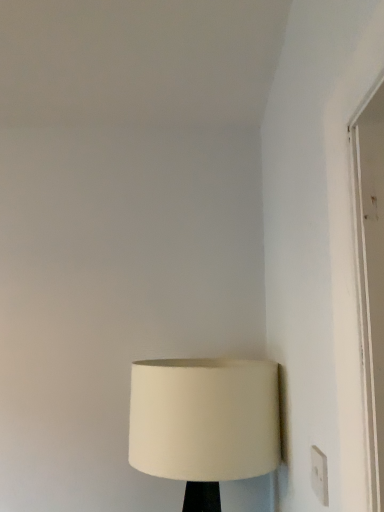
Question: Is point (167, 387) closer or farther from the camera than point (322, 478)?

Choices:
 (A) farther
 (B) closer

Answer: (A)

Question: Is white fabric lampshade at lower center taller or shorter than white plastic electric outlet at lower right?

Choices:
 (A) tall
 (B) short

Answer: (A)

Question: In terms of width, does white fabric lampshade at lower center look wider or thinner when compared to white plastic electric outlet at lower right?

Choices:
 (A) thin
 (B) wide

Answer: (B)

Question: In terms of height, does white plastic electric outlet at lower right look taller or shorter compared to white fabric lampshade at lower center?

Choices:
 (A) short
 (B) tall

Answer: (A)

Question: Does point (324, 460) appear closer or farther from the camera than point (137, 386)?

Choices:
 (A) closer
 (B) farther

Answer: (A)

Question: Do you think white plastic electric outlet at lower right is within white fabric lampshade at lower center, or outside of it?

Choices:
 (A) inside
 (B) outside

Answer: (B)

Question: From the image's perspective, is white plastic electric outlet at lower right located above or below white fabric lampshade at lower center?

Choices:
 (A) above
 (B) below

Answer: (A)